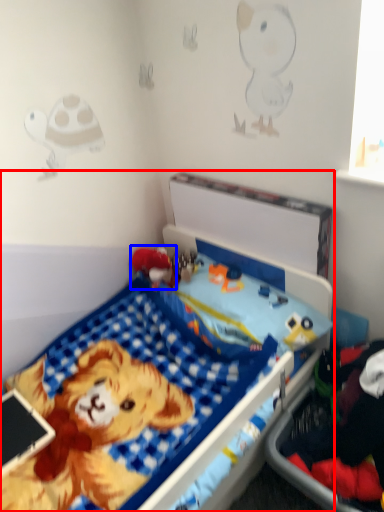
Question: Which of the following is the farthest to the observer, bed (highlighted by a red box) or toy (highlighted by a blue box)?

Choices:
 (A) bed
 (B) toy

Answer: (B)